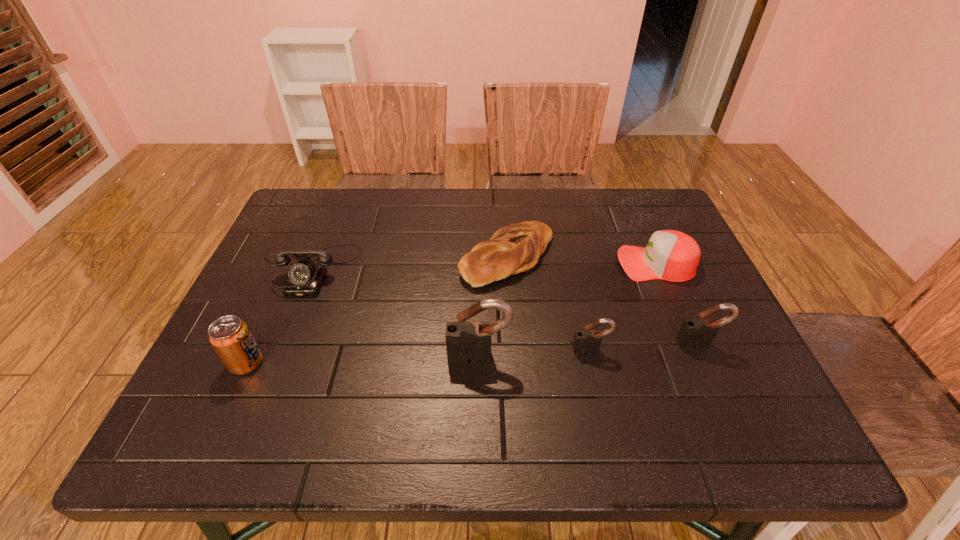
The padlocks are evenly distributed in the image. To maintain this, where would you place another padlock on the left? Please point to a free space. Please provide its 2D coordinates. Your answer should be formatted as a tuple, i.e. [(x, y)], where the tuple contains the x and y coordinates of a point satisfying the conditions above.

[(365, 363)]